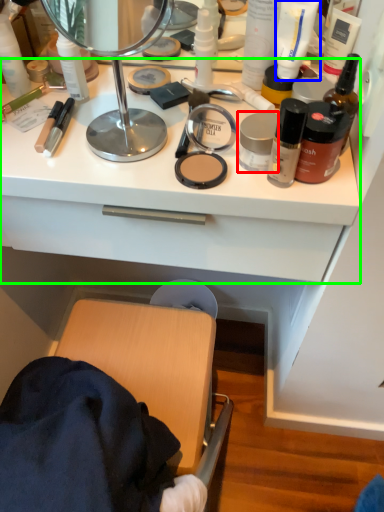
Question: Based on their relative distances, which object is farther from toiletry (highlighted by a red box)? Choose from toiletry (highlighted by a blue box) and counter top (highlighted by a green box).

Choices:
 (A) toiletry
 (B) counter top

Answer: (B)